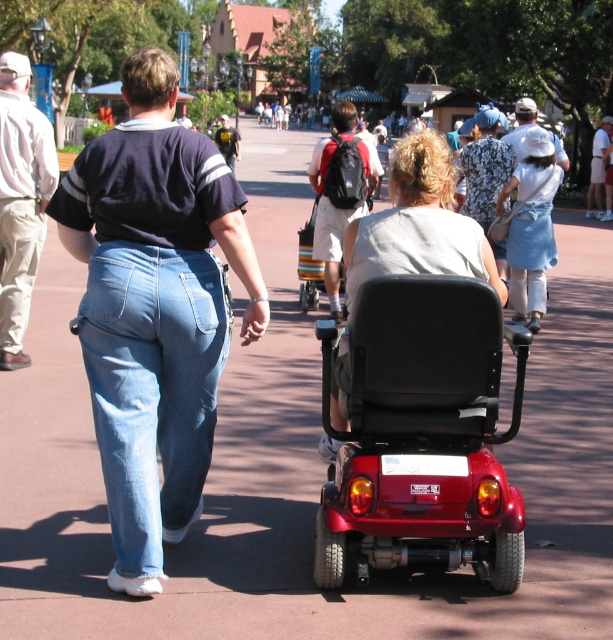
Can you confirm if light blue denim jeans at center is positioned to the right of metallic red wheelchair at center?

Incorrect, light blue denim jeans at center is not on the right side of metallic red wheelchair at center.

Between light blue denim jeans at center and metallic red wheelchair at center, which one is positioned higher?

metallic red wheelchair at center is higher up.

Does point (145, 376) lie in front of point (305, 285)?

Yes.

Where is `light blue denim jeans at center`? light blue denim jeans at center is located at coordinates (x=151, y=387).

Can you confirm if light blue denim jeans at center is bigger than matte black scooter at center?

Actually, light blue denim jeans at center might be smaller than matte black scooter at center.

Between point (134, 337) and point (405, 164), which one is positioned in front?

Point (134, 337) is in front.

Find the location of a particular element. light blue denim jeans at center is located at coordinates (151, 387).

Is blue denim jeans at center to the left of light blue denim jeans at center from the viewer's perspective?

Incorrect, blue denim jeans at center is not on the left side of light blue denim jeans at center.

How much distance is there between blue denim jeans at center and light blue denim jeans at center?

blue denim jeans at center and light blue denim jeans at center are 2.51 inches apart from each other.

The height and width of the screenshot is (640, 613). Find the location of `blue denim jeans at center`. blue denim jeans at center is located at coordinates (154, 308).

What are the coordinates of `blue denim jeans at center` in the screenshot? It's located at (154, 308).